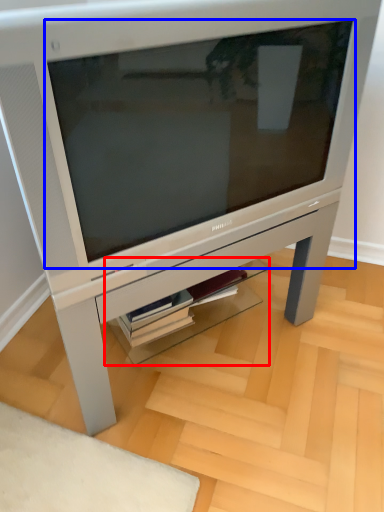
Question: Among these objects, which one is farthest to the camera, shelf (highlighted by a red box) or computer monitor (highlighted by a blue box)?

Choices:
 (A) shelf
 (B) computer monitor

Answer: (A)